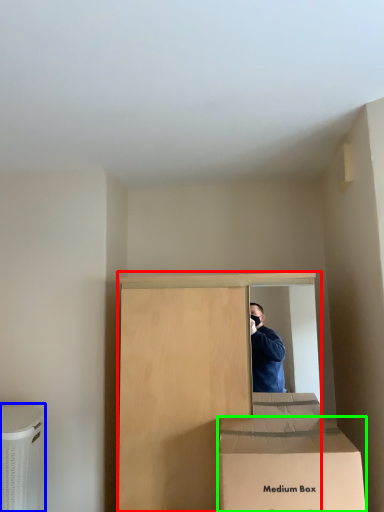
Question: Which is nearer to the furniture (highlighted by a red box)? cardboard box (highlighted by a blue box) or box (highlighted by a green box).

Choices:
 (A) cardboard box
 (B) box

Answer: (B)